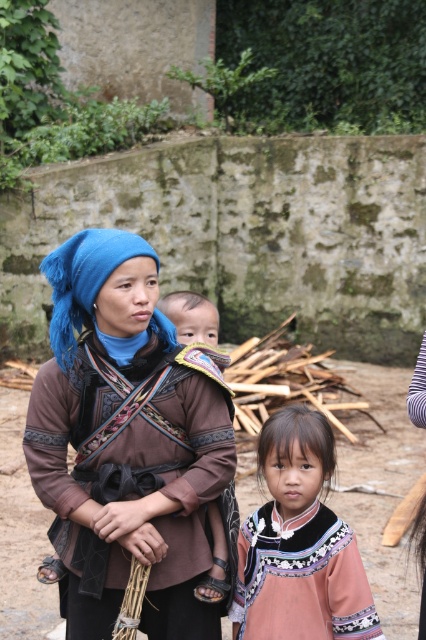
You are a photographer trying to capture a detailed shot of both the matte brown fabric at center and the pink fabric dress at center. Since you can only focus on one object at a time, which one should you choose to ensure the other remains in the background?

The matte brown fabric at center is closer to the viewer than the pink fabric dress at center, so focusing on the matte brown fabric at center will place the pink fabric dress at center in the background.

You are a photographer standing in front of the scene. You want to take a photo of the blue fabric headdress at center and the brown fabric baby at center. If your camera has a maximum focus range of 3 feet, will both objects be in focus?

The distance between the blue fabric headdress at center and the brown fabric baby at center is 3.62 feet. Since the camera can only focus within 3 feet, the objects are beyond the maximum focus range. Therefore, both objects cannot be in focus simultaneously.

You are a photographer trying to capture a closeup of the blue fabric headdress at center and the brown fabric baby at center. Which object should you zoom in on first to ensure both are in frame?

The blue fabric headdress at center is wider than the brown fabric baby at center, so you should zoom in on the brown fabric baby at center first to ensure both fit within the frame.